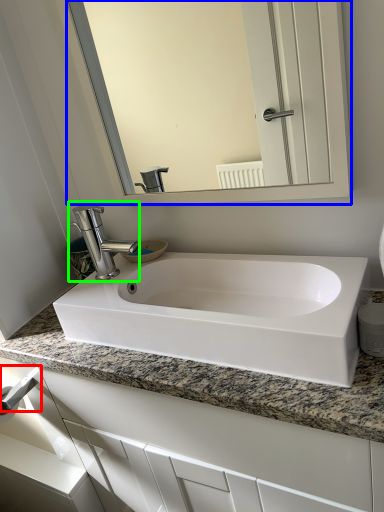
Question: Which object is positioned farthest from towel bar (highlighted by a red box)? Select from mirror (highlighted by a blue box) and tap (highlighted by a green box).

Choices:
 (A) mirror
 (B) tap

Answer: (A)